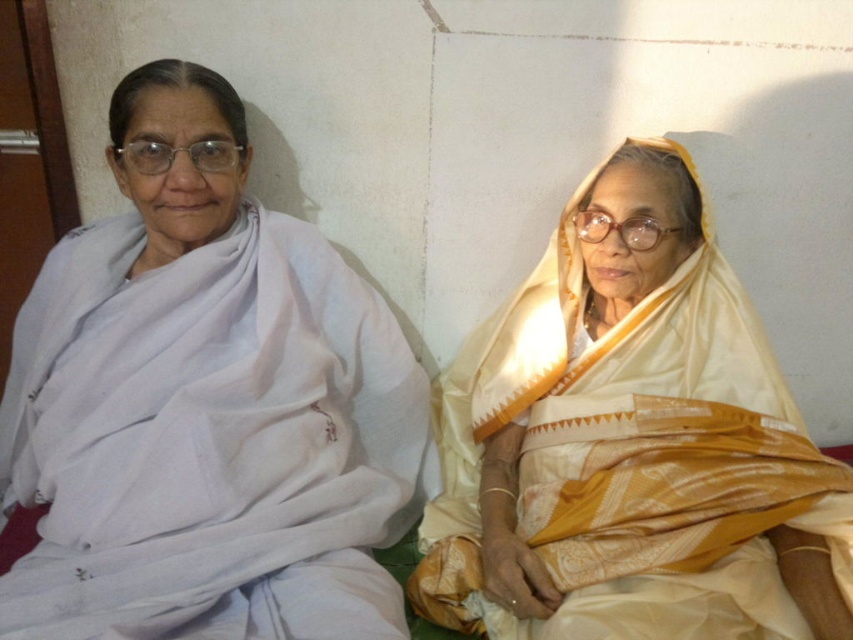
Question: Is white cotton sari at left bigger than silky yellow sari at right?

Choices:
 (A) yes
 (B) no

Answer: (A)

Question: From the image, what is the correct spatial relationship of white cotton sari at left in relation to silky yellow sari at right?

Choices:
 (A) below
 (B) above

Answer: (B)

Question: Does white cotton sari at left appear under silky yellow sari at right?

Choices:
 (A) yes
 (B) no

Answer: (B)

Question: Which of the following is the closest to the observer?

Choices:
 (A) white cotton sari at left
 (B) silky yellow sari at right

Answer: (A)

Question: Which point is closer to the camera?

Choices:
 (A) white cotton sari at left
 (B) silky yellow sari at right

Answer: (A)

Question: Which object appears farthest from the camera in this image?

Choices:
 (A) white cotton sari at left
 (B) silky yellow sari at right

Answer: (B)